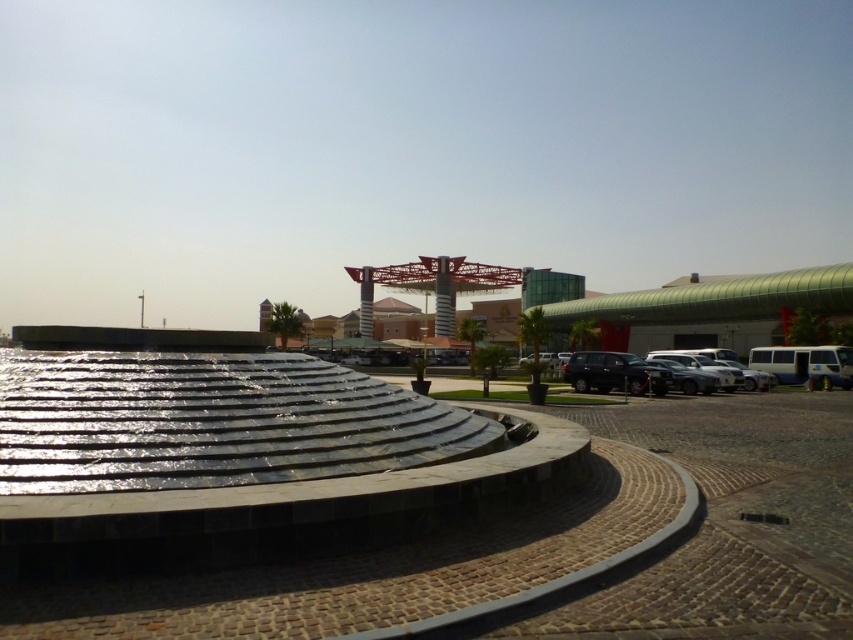
You are standing in the plaza and want to reach the point marked as point (x=640, y=321). If your walking speed is 1.5 meters per second, how long will it take you to reach that point?

The point (x=640, y=321) is 59.57 meters away from the viewer. At a walking speed of 1.5 meters per second, it would take approximately 39.7 seconds to reach it.

You are standing in the plaza and want to walk from the shiny black suv at center to the metallic glass mall at center. Which direction should you head?

You should head to the right because the metallic glass mall at center is to the right of the shiny black suv at center.

You are standing at the entrance of the plaza and want to find the metallic glass mall at center. Based on the coordinates provided, in which direction should you walk to reach it?

The metallic glass mall at center is located at coordinates point (712, 301), so you should walk towards the center of the plaza to reach it.